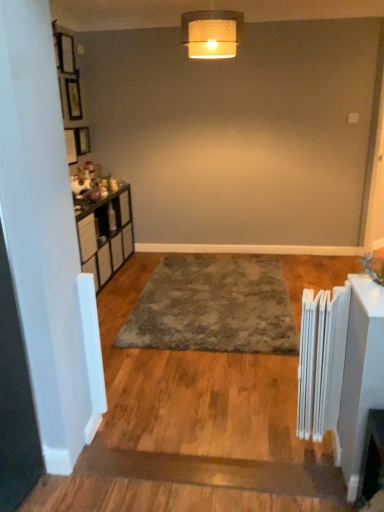
Question: In the image, is wooden picture frame at upper left positioned in front of or behind white metallic radiator at right?

Choices:
 (A) behind
 (B) front

Answer: (A)

Question: Looking at their shapes, would you say wooden picture frame at upper left is wider or thinner than white metallic radiator at right?

Choices:
 (A) wide
 (B) thin

Answer: (B)

Question: Which is farther from the woven fabric lampshade at upper center?

Choices:
 (A) gray shaggy rug at center
 (B) white metallic radiator at right
 (C) wooden picture frame at upper left

Answer: (B)

Question: Which object is the closest to the wooden picture frame at upper left?

Choices:
 (A) woven fabric lampshade at upper center
 (B) gray shaggy rug at center
 (C) white metallic radiator at right

Answer: (A)